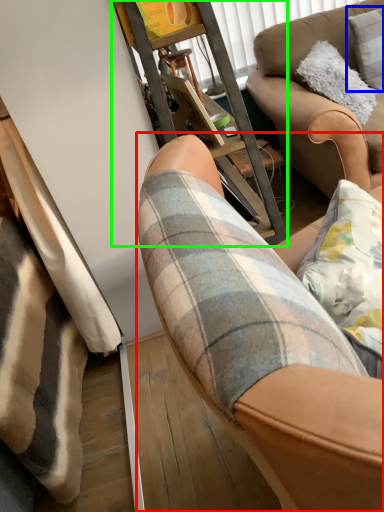
Question: Which object is positioned closest to chair (highlighted by a red box)? Select from pillow (highlighted by a blue box) and furniture (highlighted by a green box).

Choices:
 (A) pillow
 (B) furniture

Answer: (B)